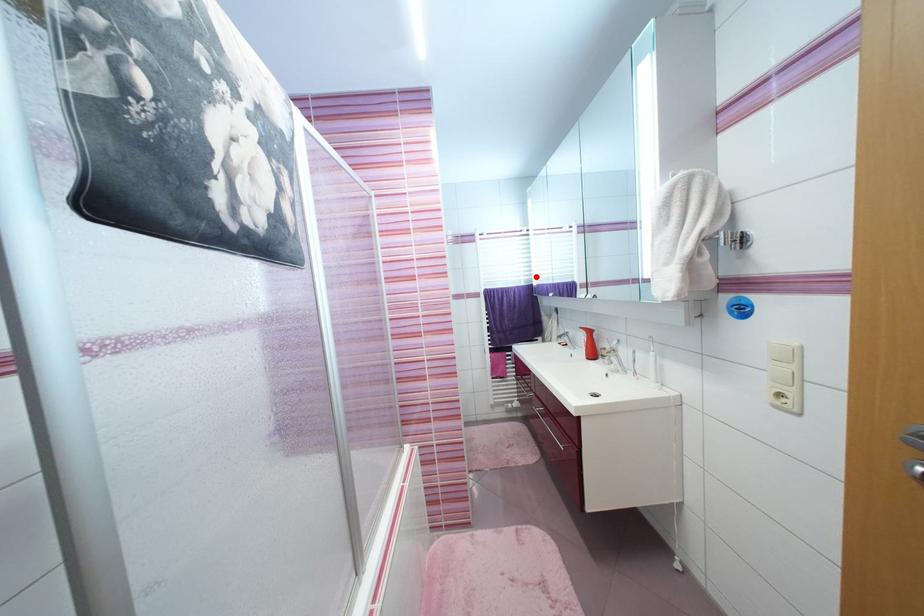
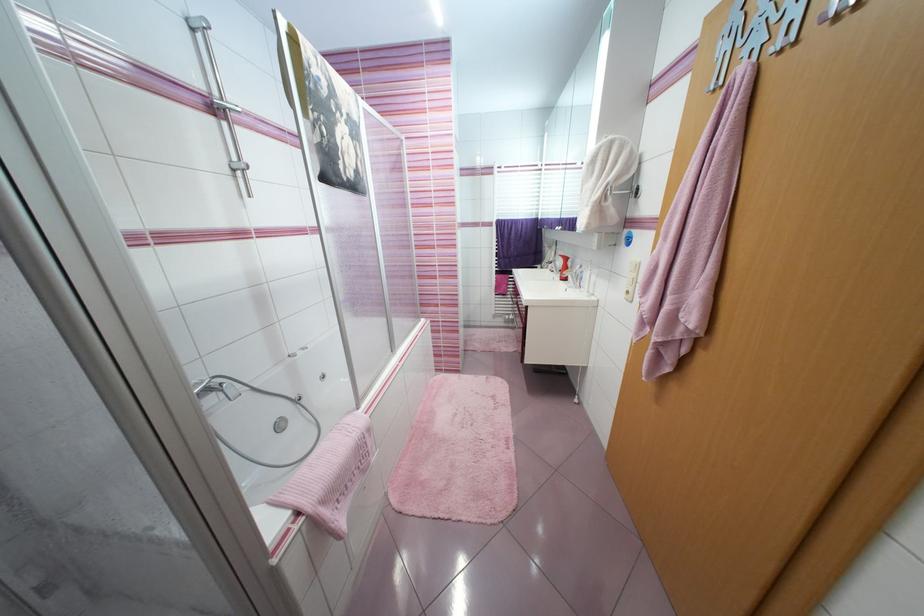
Question: I am providing you with two images of the same scene from different viewpoints. Given a red point in image1, look at the same physical point in image2. Is it:

Choices:
 (A) Closer to the viewpoint
 (B) Farther from the viewpoint

Answer: (A)